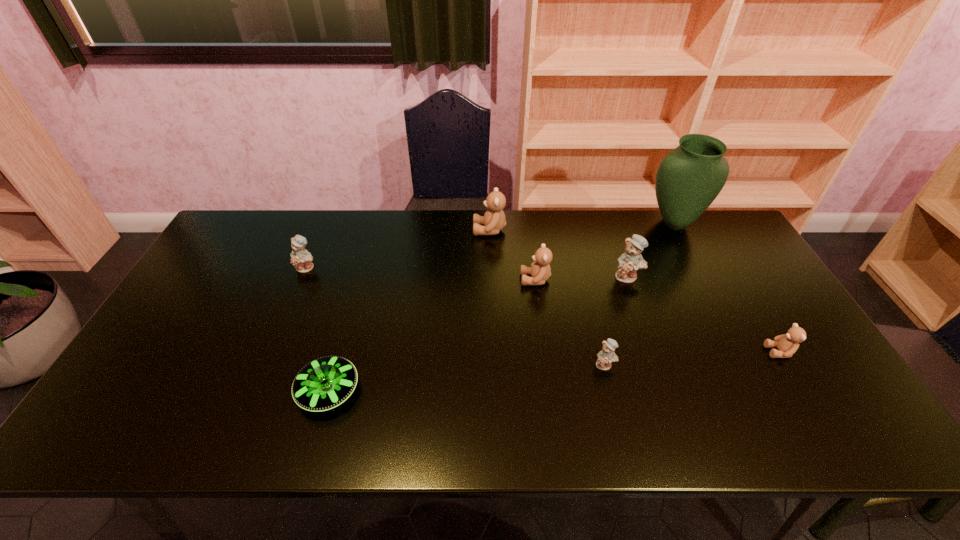
You are a GUI agent. You are given a task and a screenshot of the screen. Output one action in this format:
    pyautogui.click(x=<x>, y=<y>)
    Task: Click on the free point between the shortest object and the nearest brown teddy bear
    The width and height of the screenshot is (960, 540).
    Given the screenshot: What is the action you would take?
    pyautogui.click(x=554, y=372)

Identify the location of vacant point located between the vase and the second farthest brown teddy bear. The height and width of the screenshot is (540, 960). (605, 252).

I want to click on object that is the seventh closest to the vase, so click(x=301, y=259).

Where is `object that is the sixth closest to the fourth object from right to left`? The width and height of the screenshot is (960, 540). object that is the sixth closest to the fourth object from right to left is located at coordinates click(x=325, y=383).

Locate which teddy bear ranks fourth in proximity to the second biggest blue teddy bear. Please provide its 2D coordinates. Your answer should be formatted as a tuple, i.e. [(x, y)], where the tuple contains the x and y coordinates of a point satisfying the conditions above.

[(629, 262)]

Where is `teddy bear that can be found as the second closest to the fifth teddy bear from left to right`? teddy bear that can be found as the second closest to the fifth teddy bear from left to right is located at coordinates (606, 356).

Identify which brown teddy bear is the second nearest to the green vase. Please provide its 2D coordinates. Your answer should be formatted as a tuple, i.e. [(x, y)], where the tuple contains the x and y coordinates of a point satisfying the conditions above.

[(787, 344)]

Locate an element on the screen. brown teddy bear that is the closest one to the rightmost teddy bear is located at coordinates (540, 270).

Identify which blue teddy bear is the second closest to the second brown teddy bear from left to right. Please provide its 2D coordinates. Your answer should be formatted as a tuple, i.e. [(x, y)], where the tuple contains the x and y coordinates of a point satisfying the conditions above.

[(606, 356)]

Locate an element on the screen. blue teddy bear that is the closest one to the third teddy bear from left to right is located at coordinates (629, 262).